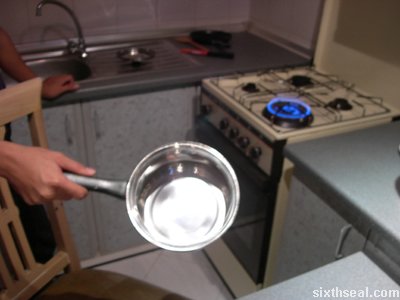
Where is `sink basin`? sink basin is located at coordinates (47, 67).